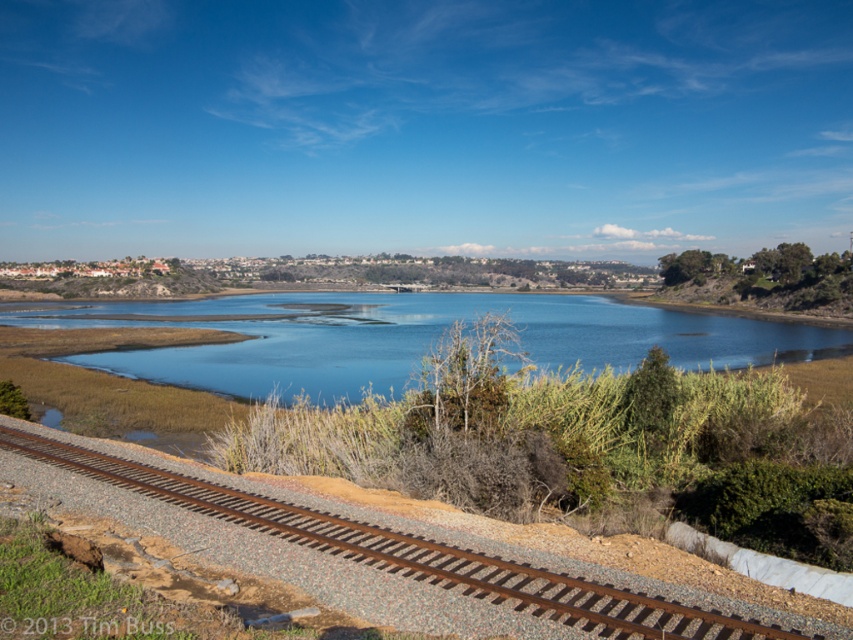
You are standing at the center of the image and want to walk towards the blue water at center. Which direction should you go?

Since the blue water at center is located at the center of the image, you are already facing it directly. You can walk straight ahead to reach the blue water at center.

You are a photographer standing at the edge of the scene. You want to capture a shot that includes both the blue water at center and the rusty metal track at lower left. Which object should you focus on first to ensure both are in frame?

You should focus on the rusty metal track at lower left first because it is closer to you than the blue water at center, which is further away. By starting with the closer object, you can adjust your framing to include both in the shot.